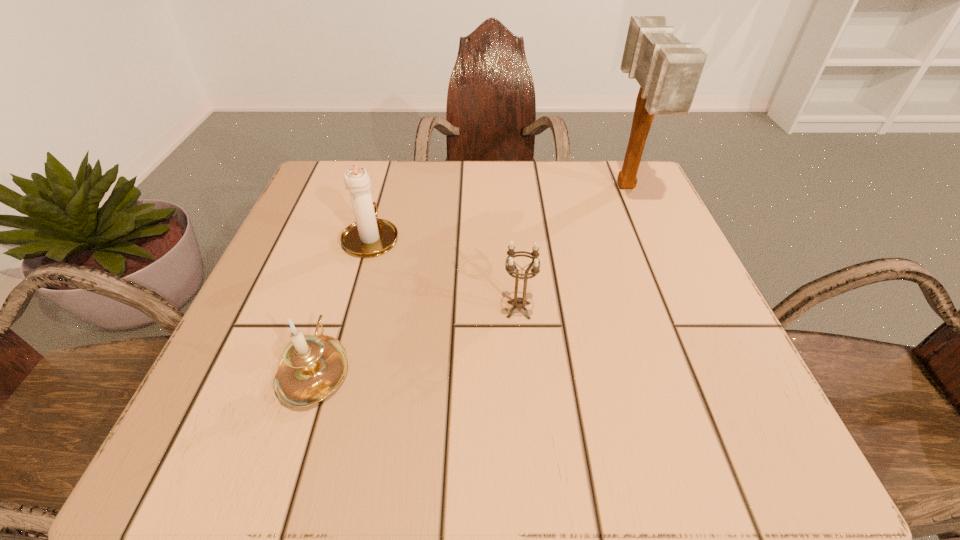
Where is `vacant space located 0.080m on the handle side of the tallest candle holder`? This screenshot has width=960, height=540. vacant space located 0.080m on the handle side of the tallest candle holder is located at coordinates (383, 195).

At what (x,y) coordinates should I click in order to perform the action: click on free space located 0.120m on the right of the second nearest candle holder. Please return your answer as a coordinate pair (x, y). Image resolution: width=960 pixels, height=540 pixels. Looking at the image, I should click on (611, 310).

Image resolution: width=960 pixels, height=540 pixels. What are the coordinates of `free space located on the handle side of the nearest candle holder` in the screenshot? It's located at (357, 237).

At what (x,y) coordinates should I click in order to perform the action: click on blank space located 0.400m on the handle side of the nearest candle holder. Please return your answer as a coordinate pair (x, y). This screenshot has height=540, width=960. Looking at the image, I should click on (372, 187).

I want to click on free space located 0.240m on the handle side of the nearest candle holder, so click(358, 233).

Identify the location of mallet present at the far edge. This screenshot has width=960, height=540. (668, 71).

At what (x,y) coordinates should I click in order to perform the action: click on candle holder that is positioned at the far edge. Please return your answer as a coordinate pair (x, y). The height and width of the screenshot is (540, 960). Looking at the image, I should click on (369, 236).

Locate an element on the screen. object that is at the near edge is located at coordinates (312, 367).

Locate an element on the screen. object present at the right edge is located at coordinates (668, 71).

The width and height of the screenshot is (960, 540). In order to click on object located in the far left corner section of the desktop in this screenshot , I will do `click(369, 236)`.